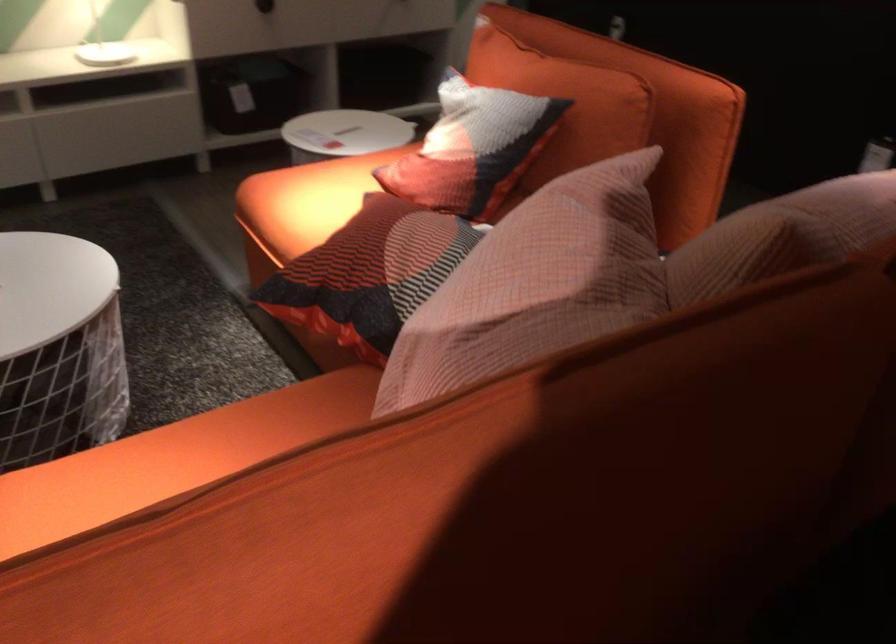
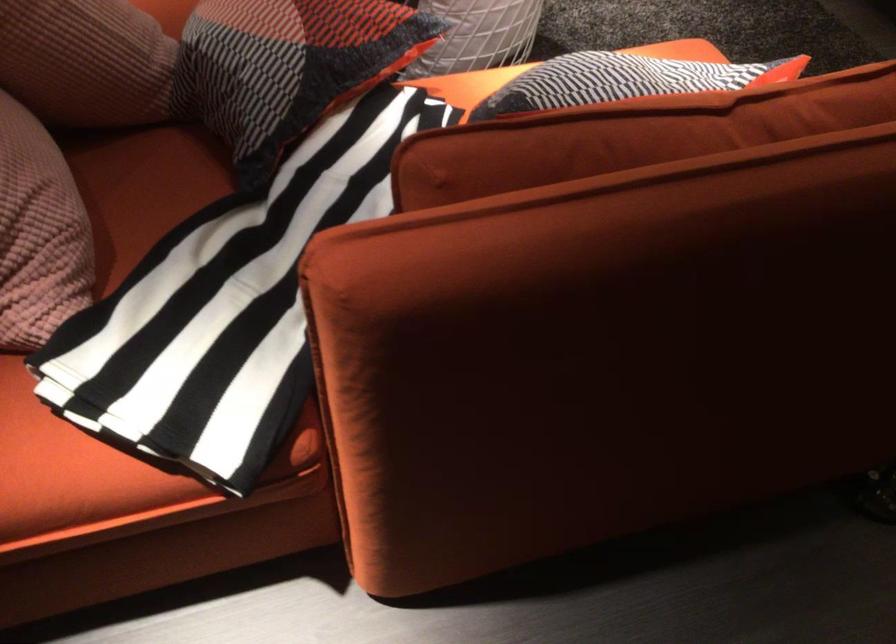
The point at (672, 118) is marked in the first image. Where is the corresponding point in the second image?

(605, 353)